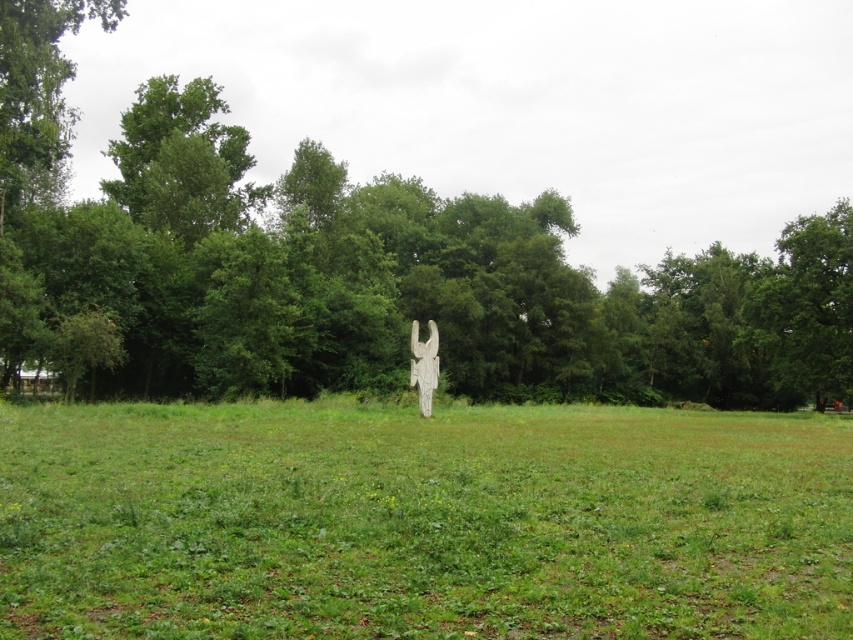
You are a gardener planning to mow the lawn. You see the green grass at center and the green leafy tree at center. Which one is closer to you?

The green grass at center is closer to you because it is smaller than the green leafy tree at center, which is further away.

You are a gardener in the field and you need to place a new flower pot between the green grass at center and the white stone statue at center. Which side of the statue should you place it on?

The green grass at center is positioned on the left side of white stone statue at center, so you should place the flower pot on the left side of the white stone statue at center to maintain alignment with the existing green grass at center.

You are standing in the open grassy field and want to take a photo of the green leafy tree at center. Which direction should you face to ensure the tree is in the center of your view?

The green leafy tree at center is located at point (361, 269), so you should face towards the center of the image where the tree is positioned to have it centered in your view.